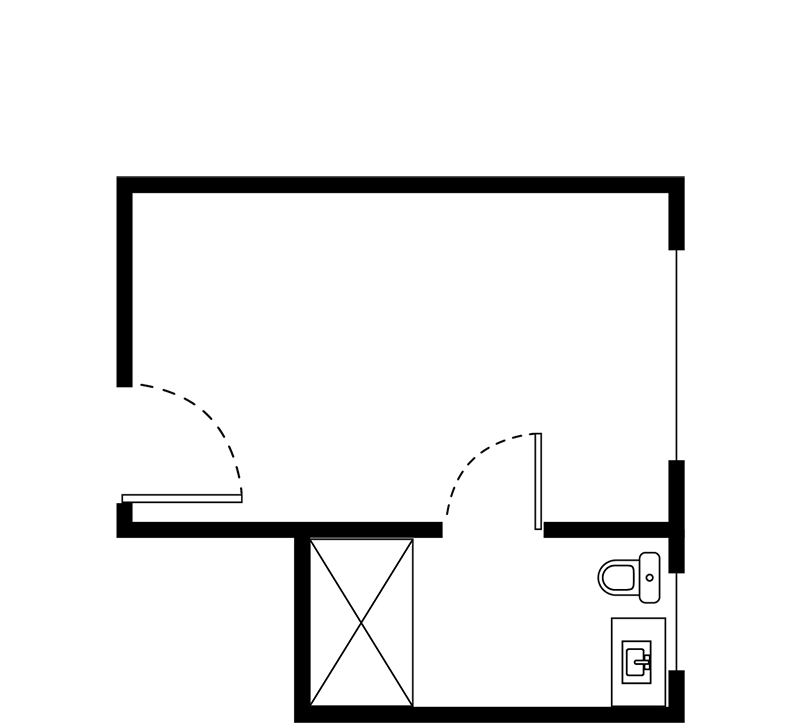
Find the location of a particular element. The image size is (800, 723). space between door and interior wall when door is open is located at coordinates (172, 510).